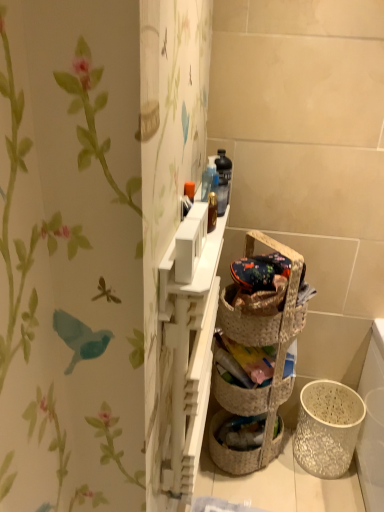
Question: Would you say woven brown picnic basket at center is a long distance from white textured basket at lower right, positioned as the 2th basket container in top-to-bottom order?

Choices:
 (A) no
 (B) yes

Answer: (A)

Question: From the image's perspective, is woven brown picnic basket at center below white textured basket at lower right, the second basket container positioned from the left?

Choices:
 (A) no
 (B) yes

Answer: (A)

Question: Does woven brown picnic basket at center have a greater width compared to white textured basket at lower right, which ranks as the first basket container in bottom-to-top order?

Choices:
 (A) no
 (B) yes

Answer: (A)

Question: Does woven brown picnic basket at center touch white textured basket at lower right, the 1th basket container from the right?

Choices:
 (A) yes
 (B) no

Answer: (B)

Question: Is woven brown picnic basket at center shorter than white textured basket at lower right, positioned as the 2th basket container in top-to-bottom order?

Choices:
 (A) yes
 (B) no

Answer: (A)

Question: Considering their positions, is white matte cabinet at upper center located in front of or behind woven brown picnic basket at center?

Choices:
 (A) behind
 (B) front

Answer: (B)

Question: Is white matte cabinet at upper center bigger or smaller than woven brown picnic basket at center?

Choices:
 (A) big
 (B) small

Answer: (A)

Question: Visually, is white matte cabinet at upper center positioned to the left or to the right of woven brown picnic basket at center?

Choices:
 (A) right
 (B) left

Answer: (B)

Question: Considering the positions of white matte cabinet at upper center and woven brown picnic basket at center in the image, is white matte cabinet at upper center taller or shorter than woven brown picnic basket at center?

Choices:
 (A) tall
 (B) short

Answer: (A)

Question: Is woven straw basket at center, placed as the 1th basket container when sorted from top to bottom, bigger or smaller than white matte cabinet at upper center?

Choices:
 (A) big
 (B) small

Answer: (B)

Question: Is woven straw basket at center, which is counted as the 2th basket container, starting from the right, inside or outside of white matte cabinet at upper center?

Choices:
 (A) inside
 (B) outside

Answer: (B)

Question: Considering their positions, is woven straw basket at center, placed as the 1th basket container when sorted from top to bottom, located in front of or behind white matte cabinet at upper center?

Choices:
 (A) behind
 (B) front

Answer: (A)

Question: In terms of width, does woven straw basket at center, positioned as the first basket container in left-to-right order, look wider or thinner when compared to white matte cabinet at upper center?

Choices:
 (A) thin
 (B) wide

Answer: (B)

Question: Considering their positions, is white matte cabinet at upper center located in front of or behind white textured basket at lower right, positioned as the 2th basket container in top-to-bottom order?

Choices:
 (A) behind
 (B) front

Answer: (B)

Question: From a real-world perspective, is white matte cabinet at upper center above or below white textured basket at lower right, which ranks as the first basket container in bottom-to-top order?

Choices:
 (A) below
 (B) above

Answer: (B)